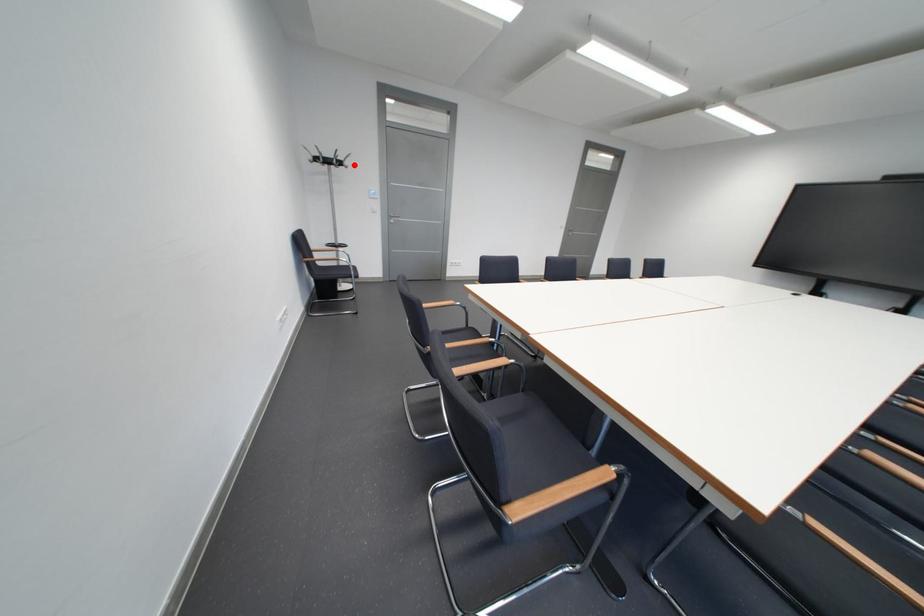
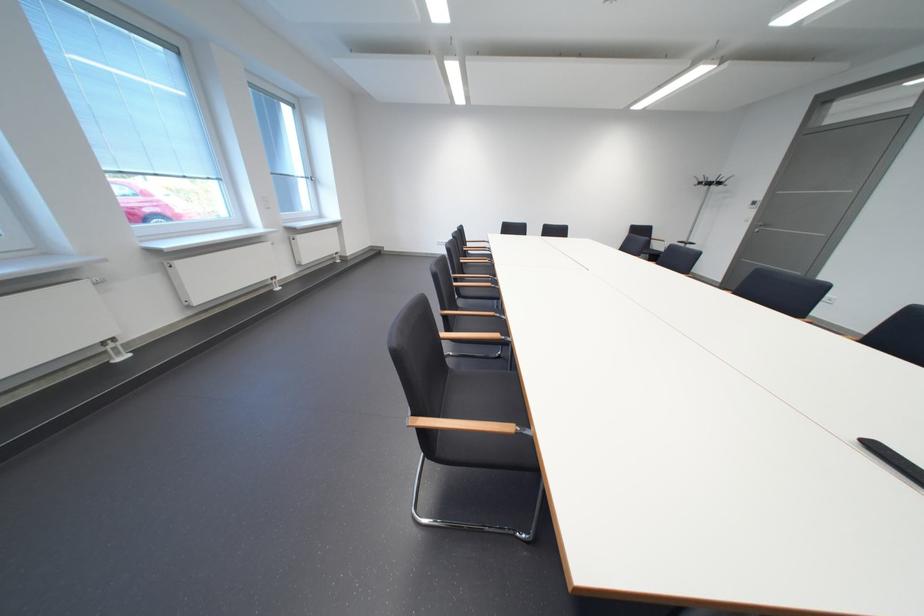
Question: A red point is marked in image1. In image2, is the corresponding 3D point closer to the camera or farther? Reply with the corresponding letter.

Choices:
 (A) The corresponding 3D point is closer.
 (B) The corresponding 3D point is farther.

Answer: (B)